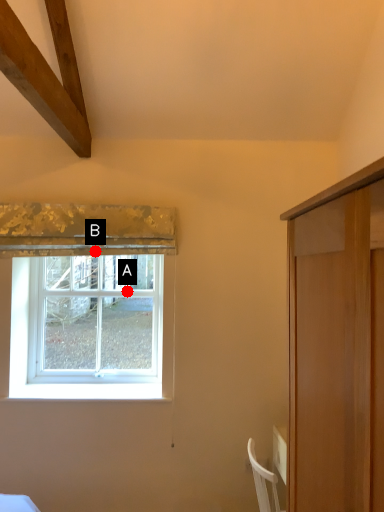
Question: Two points are circled on the image, labeled by A and B beside each circle. Which point is further to the camera?

Choices:
 (A) A is further
 (B) B is further

Answer: (A)